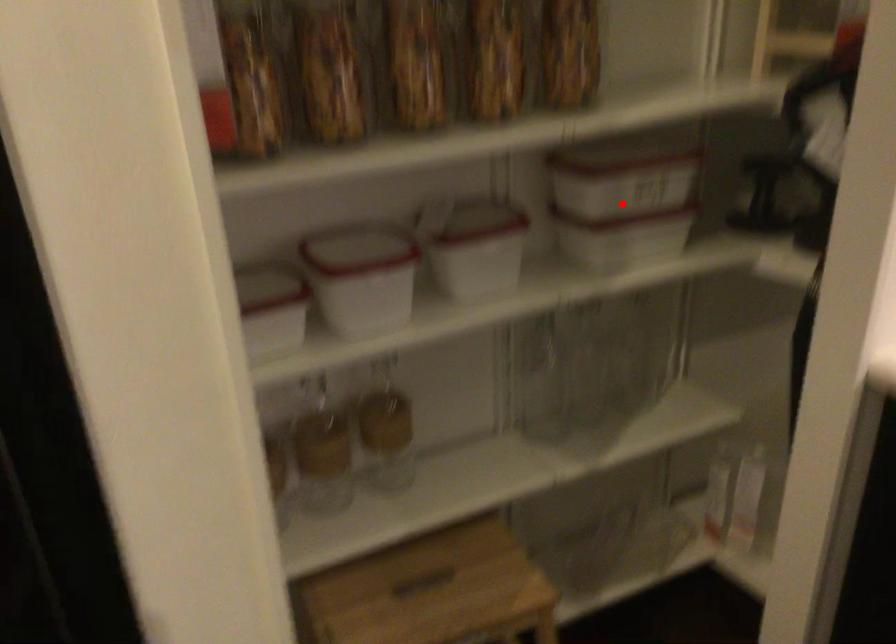
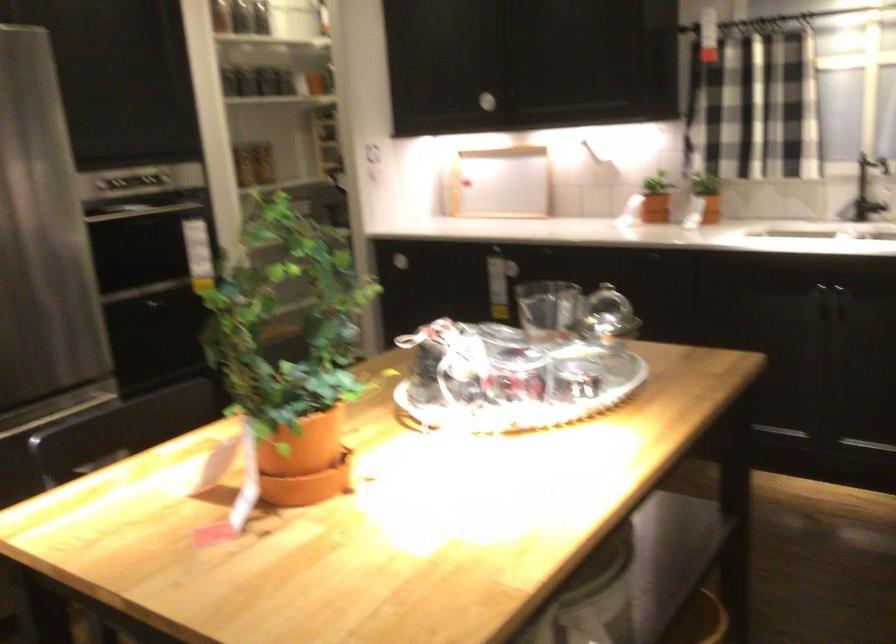
Question: I am providing you with two images of the same scene from different viewpoints. A red point is marked on the first image. Is the red point's position out of view in image 2?

Choices:
 (A) Yes
 (B) No

Answer: (A)